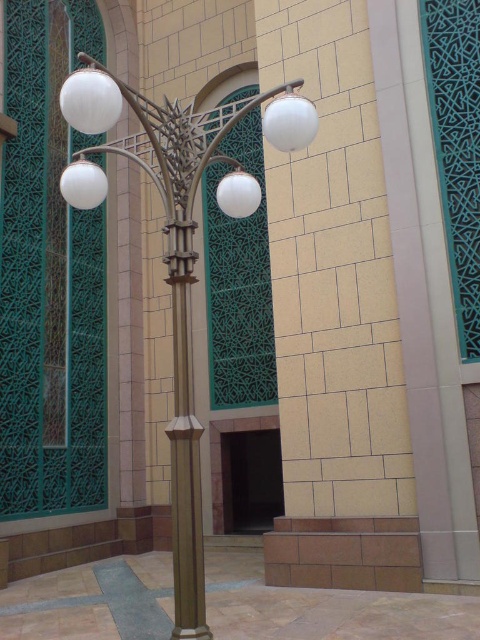
Question: Is metallic gold streetlight at center positioned at the back of gold metallic pole at center?

Choices:
 (A) yes
 (B) no

Answer: (B)

Question: Which point is farther to the camera?

Choices:
 (A) metallic gold streetlight at center
 (B) gold metallic pole at center

Answer: (B)

Question: From the image, what is the correct spatial relationship of metallic gold streetlight at center in relation to gold metallic pole at center?

Choices:
 (A) left
 (B) right

Answer: (A)

Question: Which of the following is the farthest from the observer?

Choices:
 (A) (228, 209)
 (B) (203, 589)

Answer: (A)

Question: Is metallic gold streetlight at center smaller than gold metallic pole at center?

Choices:
 (A) yes
 (B) no

Answer: (B)